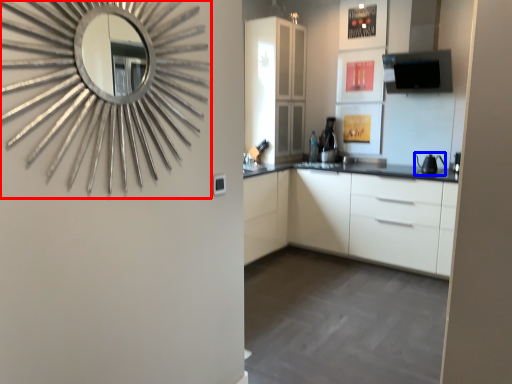
Question: Which object is closer to the camera taking this photo, mirror (highlighted by a red box) or appliance (highlighted by a blue box)?

Choices:
 (A) mirror
 (B) appliance

Answer: (A)